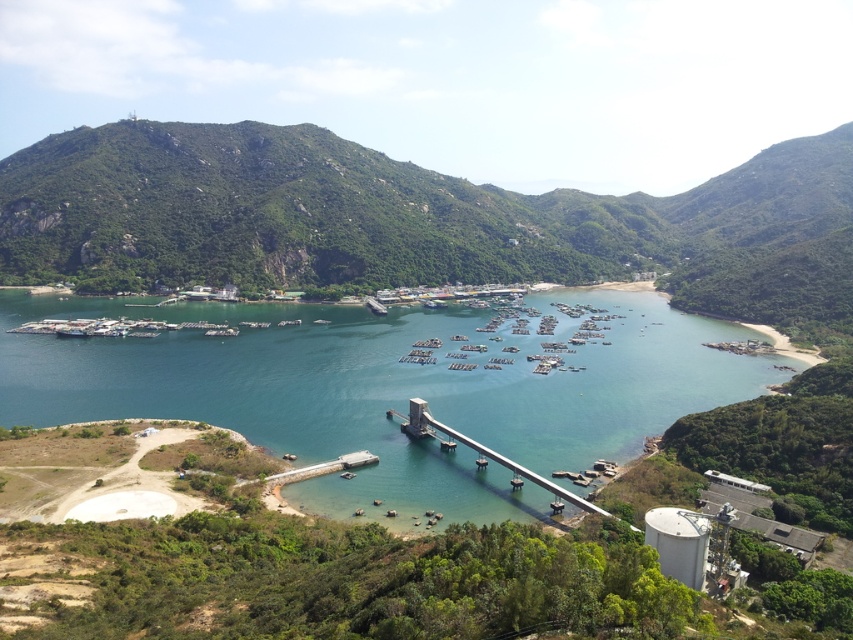
This screenshot has width=853, height=640. Describe the element at coordinates (416, 220) in the screenshot. I see `green leafy mountain at center` at that location.

Consider the image. Is green leafy mountain at center closer to the viewer compared to clear blue water at center?

No, it is behind clear blue water at center.

Identify the location of green leafy mountain at center. (416, 220).

The image size is (853, 640). Describe the element at coordinates (390, 388) in the screenshot. I see `clear blue water at center` at that location.

The image size is (853, 640). I want to click on clear blue water at center, so click(x=390, y=388).

In order to click on green leafy mountain at center in this screenshot , I will do `click(416, 220)`.

Who is positioned more to the left, green leafy mountain at center or metallic gray bridge at center?

Positioned to the left is metallic gray bridge at center.

Where is `green leafy mountain at center`? The height and width of the screenshot is (640, 853). green leafy mountain at center is located at coordinates (416, 220).